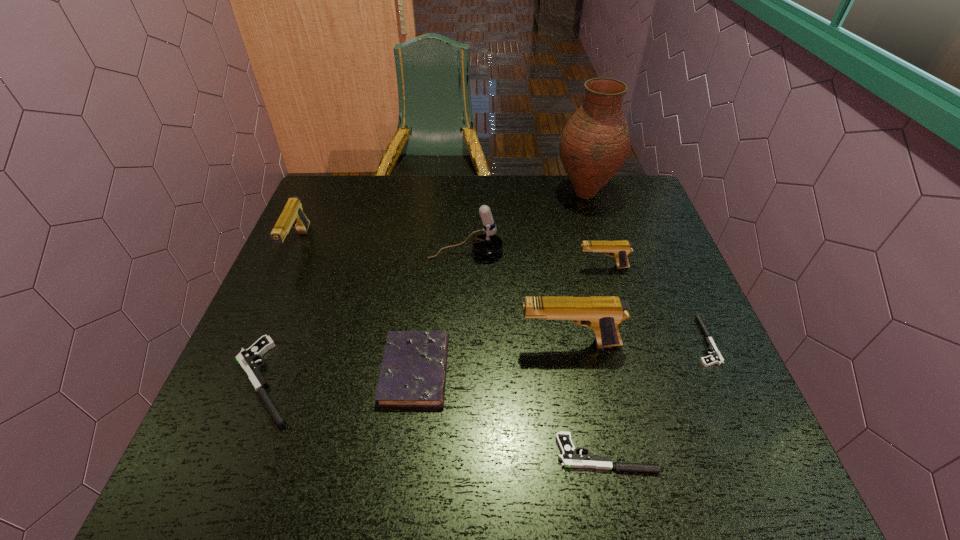
Where is `the third shortest pistol`? This screenshot has height=540, width=960. the third shortest pistol is located at coordinates (247, 358).

The width and height of the screenshot is (960, 540). Find the location of `the seventh tallest object`. the seventh tallest object is located at coordinates pos(247,358).

At what (x,y) coordinates should I click in order to perform the action: click on the second shortest pistol. Please return your answer as a coordinate pair (x, y). Image resolution: width=960 pixels, height=540 pixels. Looking at the image, I should click on (569, 458).

You are a GUI agent. You are given a task and a screenshot of the screen. Output one action in this format:
    pyautogui.click(x=<x>, y=<y>)
    Task: Click on the second black pistol from right to left
    Image resolution: width=960 pixels, height=540 pixels.
    Given the screenshot: What is the action you would take?
    pyautogui.click(x=569, y=458)

Where is `the shortest pistol`? Image resolution: width=960 pixels, height=540 pixels. the shortest pistol is located at coordinates (716, 358).

Locate an element on the screen. the rightmost black pistol is located at coordinates (716, 358).

Find the location of a particular element. The height and width of the screenshot is (540, 960). blank space located on the left of the tallest object is located at coordinates (440, 193).

I want to click on free region located 0.320m on the back of the microphone, so click(468, 179).

The width and height of the screenshot is (960, 540). I want to click on free space located at the barrel of the biggest tan pistol, so click(344, 343).

Identify the location of vacant space located 0.150m at the barrel of the biggest tan pistol. (452, 343).